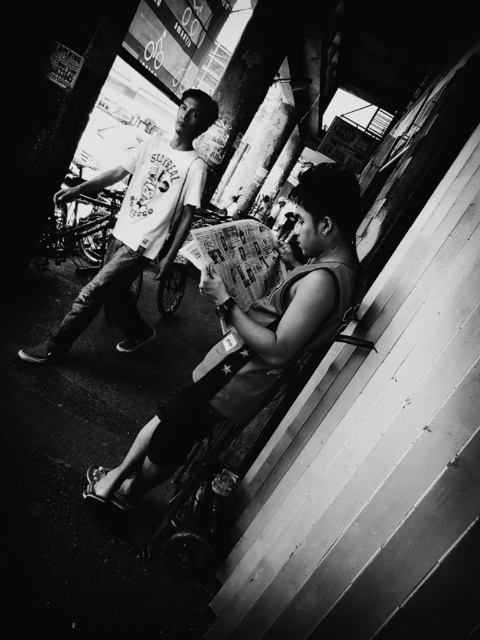
You are a delivery person who needs to carry a package that is as wide as the smooth paper newspaper at center. Can you place this package on the wooden stair at lower right without it hanging over the edges?

The wooden stair at lower right has a lesser width compared to smooth paper newspaper at center, so the package will hang over the edges since the stair is narrower than the newspaper.

You are standing at the center of the image and want to walk towards the wooden stair at lower right. What direction should you move in?

You should move towards the lower right direction to reach the wooden stair at lower right.

You are a delivery person who needs to place a package on the wooden stair at lower right and the smooth paper newspaper at center. Which object is closer to you so you can reach it first?

The wooden stair at lower right is closer to the viewer than the smooth paper newspaper at center, so you can reach the wooden stair at lower right first.